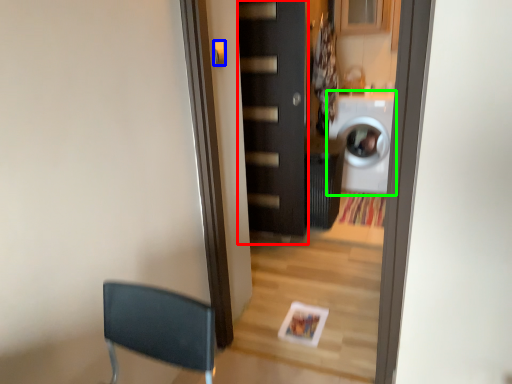
Question: Which is nearer to the door (highlighted by a red box)? door handle (highlighted by a blue box) or washing machine (highlighted by a green box).

Choices:
 (A) door handle
 (B) washing machine

Answer: (B)